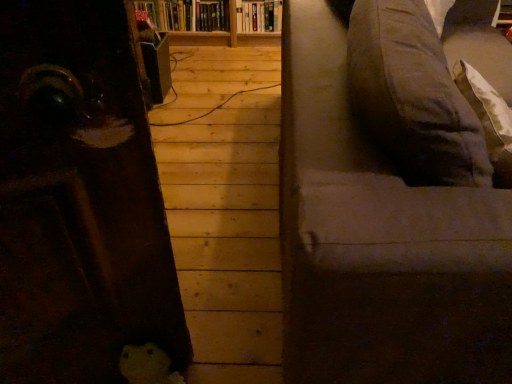
Question: From a real-world perspective, is dark gray fabric couch at right over hardcover book at upper center, positioned as the 2th book in left-to-right order?

Choices:
 (A) yes
 (B) no

Answer: (A)

Question: Is dark gray fabric couch at right aimed at hardcover book at upper center, positioned as the 2th book in left-to-right order?

Choices:
 (A) yes
 (B) no

Answer: (B)

Question: Can you confirm if dark gray fabric couch at right is positioned to the right of hardcover book at upper center, which is the 1th book from right to left?

Choices:
 (A) yes
 (B) no

Answer: (A)

Question: Is dark gray fabric couch at right not inside hardcover book at upper center, which is the 1th book from right to left?

Choices:
 (A) yes
 (B) no

Answer: (A)

Question: From a real-world perspective, does dark gray fabric couch at right sit lower than hardcover book at upper center, which is the 1th book from right to left?

Choices:
 (A) no
 (B) yes

Answer: (A)

Question: Is dark gray fabric couch at right taller than hardcover book at upper center, positioned as the 2th book in left-to-right order?

Choices:
 (A) no
 (B) yes

Answer: (B)

Question: From a real-world perspective, is hardcover book at upper center, which is the second book from right to left, positioned over dark gray fabric couch at right based on gravity?

Choices:
 (A) yes
 (B) no

Answer: (B)

Question: Can you confirm if hardcover book at upper center, which is the first book from left to right, is bigger than dark gray fabric couch at right?

Choices:
 (A) no
 (B) yes

Answer: (A)

Question: Is dark gray fabric couch at right located within hardcover book at upper center, which is the second book from right to left?

Choices:
 (A) no
 (B) yes

Answer: (A)

Question: Is hardcover book at upper center, which is the first book from left to right, further to camera compared to dark gray fabric couch at right?

Choices:
 (A) no
 (B) yes

Answer: (B)

Question: Does hardcover book at upper center, which is the first book from left to right, have a lesser height compared to dark gray fabric couch at right?

Choices:
 (A) yes
 (B) no

Answer: (A)

Question: Is hardcover book at upper center, which is the first book from left to right, positioned in front of dark gray fabric couch at right?

Choices:
 (A) no
 (B) yes

Answer: (A)

Question: From the image's perspective, does dark gray fabric couch at right appear lower than hardcover book at upper center, which is the second book from right to left?

Choices:
 (A) no
 (B) yes

Answer: (B)